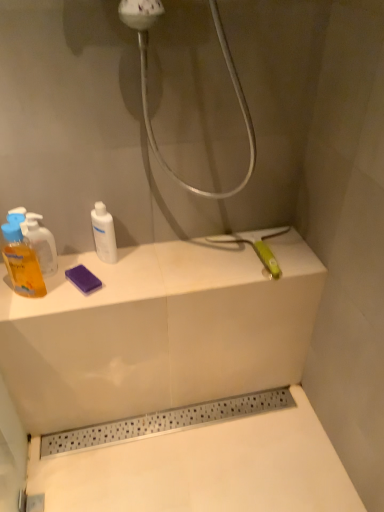
Locate an element on the screen. The width and height of the screenshot is (384, 512). free location in front of translucent orange liquid at left, acting as the second mouthwash starting from the left is located at coordinates (35, 303).